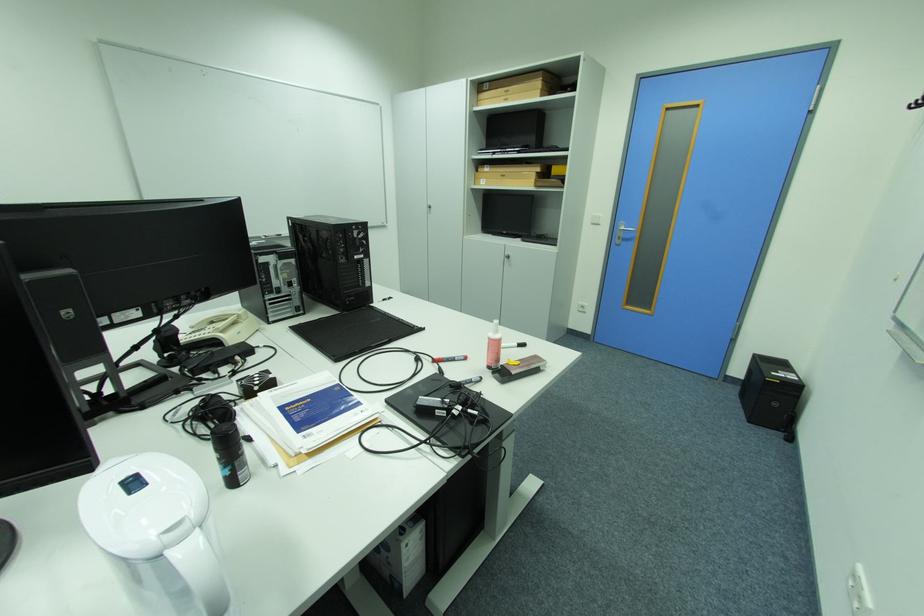
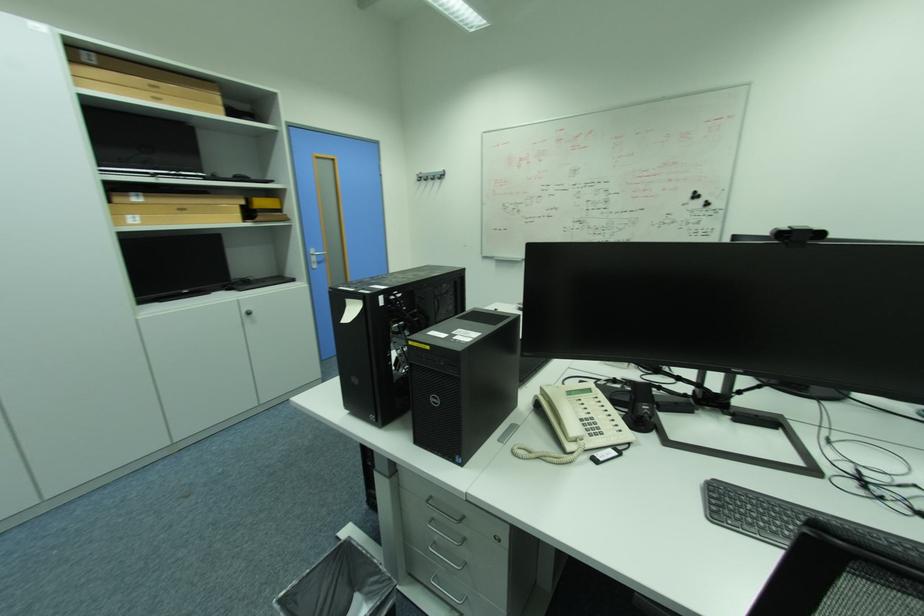
Question: I am providing you with two images of the same scene from different viewpoints. After the viewpoint changes to image2, which objects are now occluded?

Choices:
 (A) silver door handle
 (B) brown cardboard box
 (C) blue cooking pot
 (D) white pitcher handle

Answer: (D)